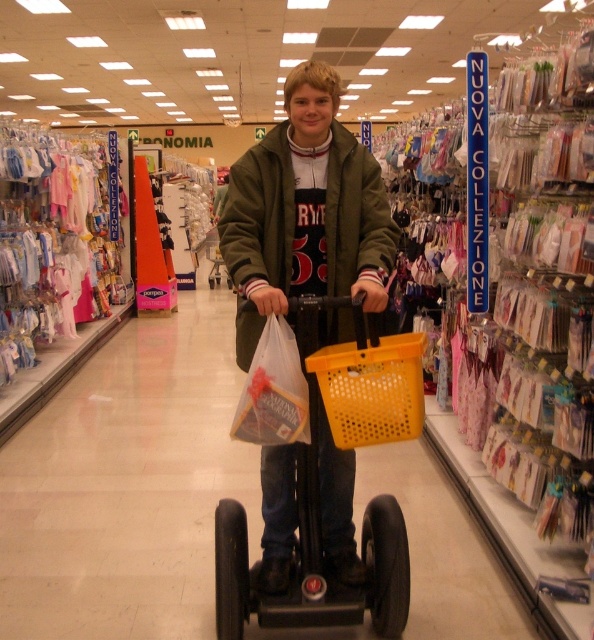
Can you confirm if yellow plastic scooter at center is taller than yellow plastic basket at center?

Yes, yellow plastic scooter at center is taller than yellow plastic basket at center.

Identify the location of yellow plastic scooter at center. The image size is (594, 640). (317, 524).

Where is `yellow plastic scooter at center`? The width and height of the screenshot is (594, 640). yellow plastic scooter at center is located at coordinates (317, 524).